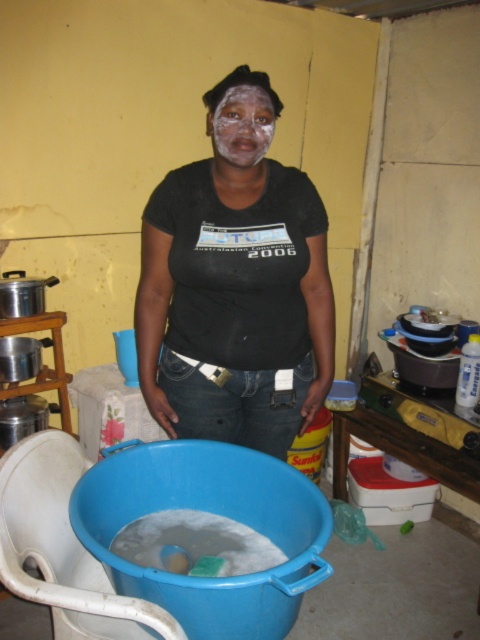
Between matte black shirt at center and blue plastic basin at lower center, which one appears on the left side from the viewer's perspective?

Positioned to the left is blue plastic basin at lower center.

What do you see at coordinates (236, 284) in the screenshot? This screenshot has height=640, width=480. I see `matte black shirt at center` at bounding box center [236, 284].

Does point (240, 253) come behind point (277, 483)?

That is True.

What are the coordinates of `matte black shirt at center` in the screenshot? It's located at (236, 284).

Between blue plastic basin at lower center and white matte face at center, which one is positioned lower?

blue plastic basin at lower center

Between blue plastic basin at lower center and white matte face at center, which one has more height?

blue plastic basin at lower center

Is point (280, 461) positioned in front of point (257, 112)?

No, it is not.

Locate an element on the screen. This screenshot has width=480, height=640. blue plastic basin at lower center is located at coordinates [x=214, y=513].

Is matte black shirt at center shorter than white matte face at center?

No.

Between point (213, 422) and point (260, 124), which one is positioned behind?

Positioned behind is point (213, 422).

At what (x,y) coordinates should I click in order to perform the action: click on matte black shirt at center. Please return your answer as a coordinate pair (x, y). Looking at the image, I should click on (236, 284).